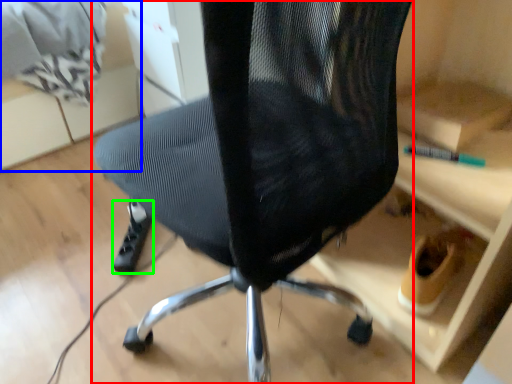
Question: Estimate the real-world distances between objects in this image. Which object is closer to chair (highlighted by a red box), shelf (highlighted by a blue box) or foot (highlighted by a green box)?

Choices:
 (A) shelf
 (B) foot

Answer: (B)